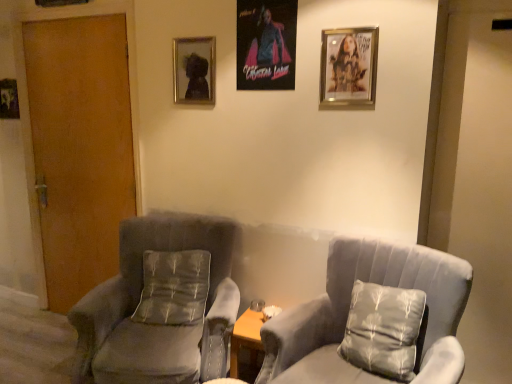
Question: From the image's perspective, is velvet gray armchair at left, which is the second chair from right to left, positioned above or below metallic silver picture frame at upper center, which appears as the second picture frame when viewed from the left?

Choices:
 (A) below
 (B) above

Answer: (A)

Question: Choose the correct answer: Is velvet gray armchair at left, the first chair viewed from the left, inside metallic silver picture frame at upper center, the third picture frame when ordered from front to back, or outside it?

Choices:
 (A) outside
 (B) inside

Answer: (A)

Question: Which object is the closest to the suede gray chair at center, arranged as the 2th chair when viewed from the left?

Choices:
 (A) satin gray pillow at right, the 1th pillow viewed from the front
 (B) metallic silver picture frame at left, which appears as the first picture frame when viewed from the left
 (C) wooden door at left
 (D) metallic silver picture frame at upper center, arranged as the 3th picture frame when viewed from the right
 (E) velvet gray armchair at left, the first chair viewed from the left

Answer: (A)

Question: Estimate the real-world distances between objects in this image. Which object is farther from the velvet gray armchair at left, the first chair viewed from the left?

Choices:
 (A) silky gray pillow at center, the 2th pillow in the right-to-left sequence
 (B) suede gray chair at center, acting as the 1th chair starting from the right
 (C) wooden door at left
 (D) satin gray pillow at right, arranged as the 2th pillow when viewed from the back
 (E) metallic silver picture frame at left, which appears as the first picture frame when viewed from the left

Answer: (E)